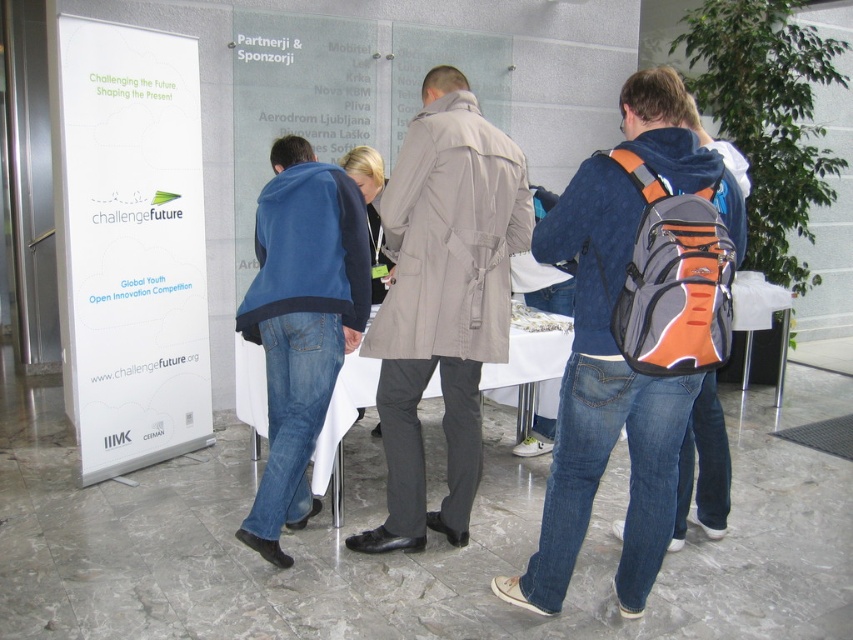
Is white paperboard at left above blue fleece jacket at center?

Indeed, white paperboard at left is positioned over blue fleece jacket at center.

Locate an element on the screen. white paperboard at left is located at coordinates (132, 244).

Locate an element on the screen. white paperboard at left is located at coordinates (132, 244).

Does point (699, 387) lie behind point (299, 435)?

That is False.

Is orange and gray backpack at center shorter than blue fleece jacket at center?

Incorrect, orange and gray backpack at center's height does not fall short of blue fleece jacket at center's.

You are a GUI agent. You are given a task and a screenshot of the screen. Output one action in this format:
    pyautogui.click(x=<x>, y=<y>)
    Task: Click on the orange and gray backpack at center
    This screenshot has width=853, height=640.
    Given the screenshot: What is the action you would take?
    pyautogui.click(x=633, y=332)

Is blue fleece jacket at center positioned before white cloth at center?

That is True.

Between point (257, 208) and point (257, 417), which one is positioned in front?

Positioned in front is point (257, 208).

The image size is (853, 640). Find the location of `blue fleece jacket at center`. blue fleece jacket at center is located at coordinates (300, 323).